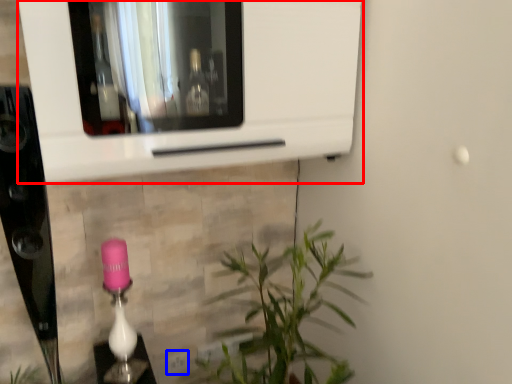
Question: Which object appears closest to the camera in this image, microwave (highlighted by a red box) or electric outlet (highlighted by a blue box)?

Choices:
 (A) microwave
 (B) electric outlet

Answer: (A)